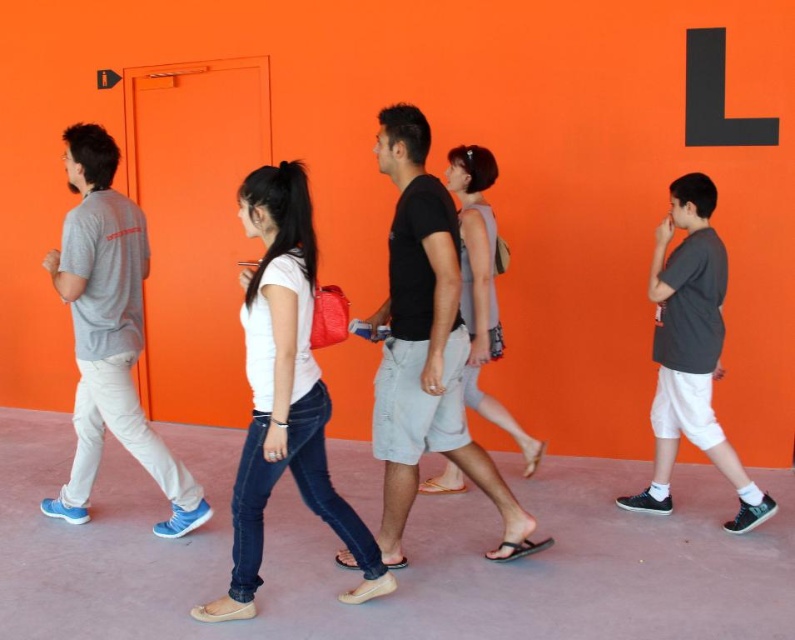
Question: Does white matte shirt at center lie behind light brown leather sandals at center?

Choices:
 (A) yes
 (B) no

Answer: (B)

Question: Among these objects, which one is nearest to the camera?

Choices:
 (A) gray cotton t-shirt at left
 (B) light brown leather sandals at center
 (C) black cotton shirt at center

Answer: (C)

Question: Can you confirm if black cotton shirt at center is thinner than white matte shirt at center?

Choices:
 (A) no
 (B) yes

Answer: (A)

Question: Can you confirm if black cotton shirt at center is positioned to the left of dark gray matte shirt at right?

Choices:
 (A) yes
 (B) no

Answer: (A)

Question: Among these points, which one is nearest to the camera?

Choices:
 (A) (710, 387)
 (B) (499, 506)

Answer: (B)

Question: Which of the following is the closest to the observer?

Choices:
 (A) light brown leather sandals at center
 (B) dark gray matte shirt at right

Answer: (A)